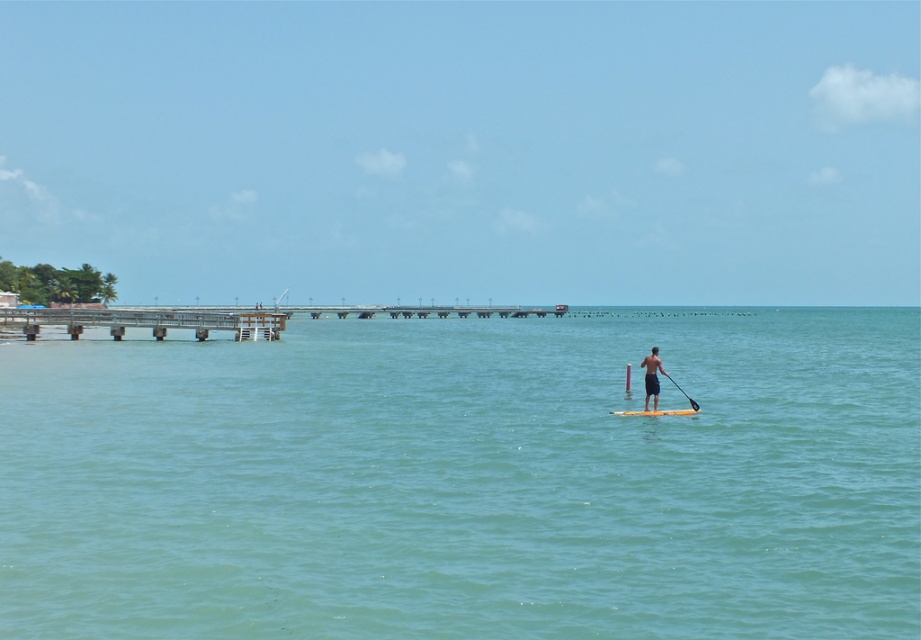
Who is shorter, clear blue water at center or yellow foam board at center?

With less height is yellow foam board at center.

Does clear blue water at center lie in front of yellow foam board at center?

Yes, clear blue water at center is in front of yellow foam board at center.

Is point (873, 540) more distant than point (662, 412)?

No, (873, 540) is in front of (662, 412).

The height and width of the screenshot is (640, 921). I want to click on clear blue water at center, so click(467, 480).

Does point (649, 394) lie behind point (671, 410)?

No, (649, 394) is closer to viewer.

Can you confirm if tan skin paddleboarder at center is positioned to the left of yellow foam board at center?

Indeed, tan skin paddleboarder at center is positioned on the left side of yellow foam board at center.

The width and height of the screenshot is (921, 640). What do you see at coordinates (651, 376) in the screenshot?
I see `tan skin paddleboarder at center` at bounding box center [651, 376].

The height and width of the screenshot is (640, 921). I want to click on tan skin paddleboarder at center, so click(651, 376).

Which is in front, point (330, 381) or point (649, 369)?

Point (649, 369) is in front.

Is clear blue water at center closer to camera compared to tan skin paddleboarder at center?

Yes, it is in front of tan skin paddleboarder at center.

Who is more forward, [855,627] or [646,364]?

Point [855,627] is more forward.

Locate an element on the screen. clear blue water at center is located at coordinates (467, 480).